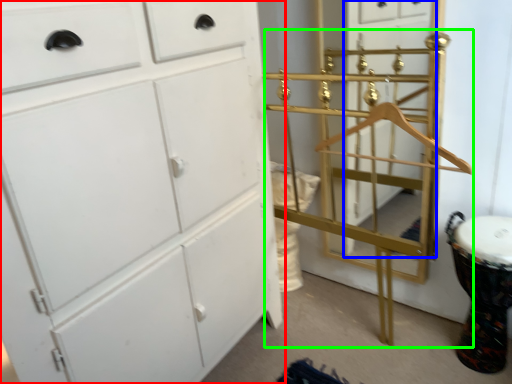
Question: Based on their relative distances, which object is nearer to chest of drawers (highlighted by a red box)? Choose from glass door (highlighted by a blue box) and bunk bed (highlighted by a green box).

Choices:
 (A) glass door
 (B) bunk bed

Answer: (B)